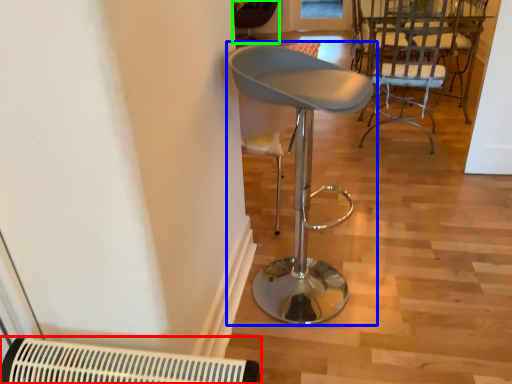
Question: Which object is the farthest from air conditioning (highlighted by a red box)? Choose among these: chair (highlighted by a blue box) or chair (highlighted by a green box).

Choices:
 (A) chair
 (B) chair

Answer: (B)